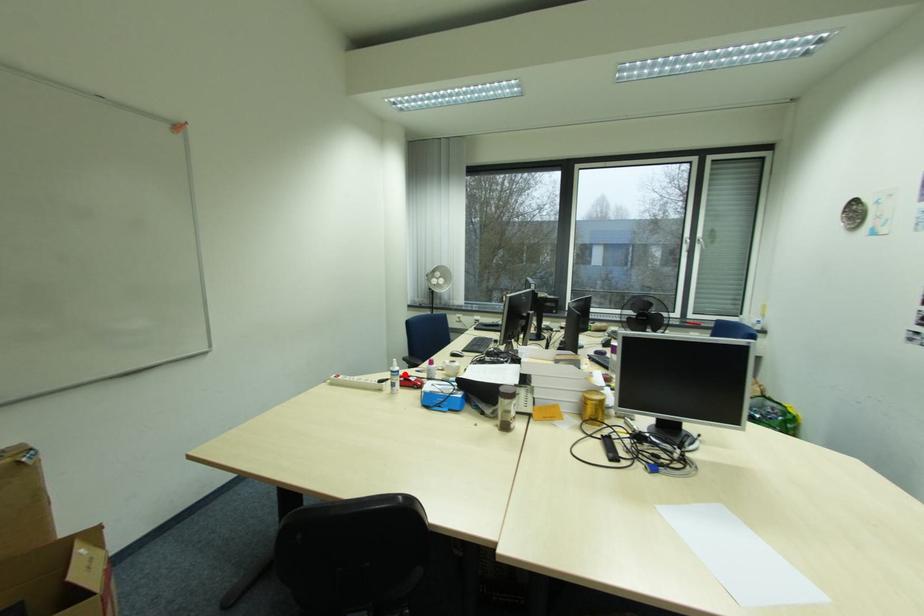
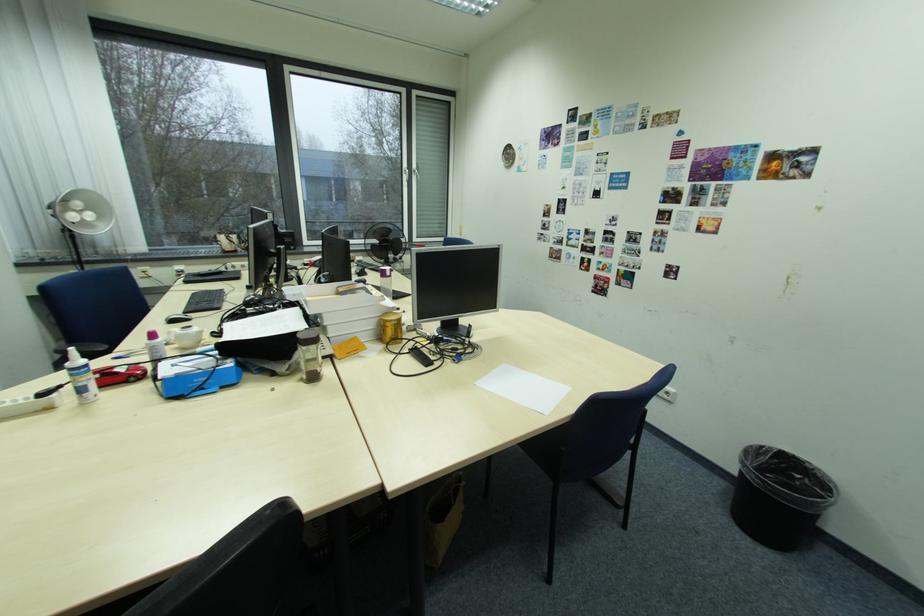
Locate, in the second image, the point that corresponds to the highlighted location in the first image.

(94, 370)